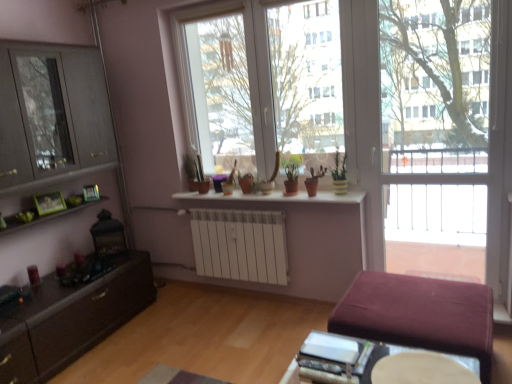
Question: Is transparent glass window at center facing away from brushed metal entertainment center at left?

Choices:
 (A) no
 (B) yes

Answer: (A)

Question: Does transparent glass window at center have a smaller size compared to brushed metal entertainment center at left?

Choices:
 (A) yes
 (B) no

Answer: (B)

Question: Could you tell me if transparent glass window at center is turned towards brushed metal entertainment center at left?

Choices:
 (A) yes
 (B) no

Answer: (B)

Question: Can you confirm if transparent glass window at center is shorter than brushed metal entertainment center at left?

Choices:
 (A) no
 (B) yes

Answer: (B)

Question: From the image's perspective, would you say transparent glass window at center is shown under brushed metal entertainment center at left?

Choices:
 (A) no
 (B) yes

Answer: (A)

Question: Is transparent glass window at center completely or partially outside of brushed metal entertainment center at left?

Choices:
 (A) yes
 (B) no

Answer: (A)

Question: Does matte brown pot at center, positioned as the 2th houseplant in right-to-left order, lie behind matte gray cabinet at left?

Choices:
 (A) no
 (B) yes

Answer: (B)

Question: Can you confirm if matte brown pot at center, positioned as the 2th houseplant in right-to-left order, is wider than matte gray cabinet at left?

Choices:
 (A) yes
 (B) no

Answer: (B)

Question: Does matte brown pot at center, positioned as the 2th houseplant in right-to-left order, have a larger size compared to matte gray cabinet at left?

Choices:
 (A) yes
 (B) no

Answer: (B)

Question: From the image's perspective, is matte brown pot at center, positioned as the 2th houseplant in right-to-left order, over matte gray cabinet at left?

Choices:
 (A) no
 (B) yes

Answer: (A)

Question: Is matte brown pot at center, arranged as the third houseplant when viewed from the left, next to matte gray cabinet at left and touching it?

Choices:
 (A) yes
 (B) no

Answer: (B)

Question: Can you confirm if matte brown pot at center, positioned as the 2th houseplant in right-to-left order, is positioned to the left of matte gray cabinet at left?

Choices:
 (A) no
 (B) yes

Answer: (A)

Question: Are matte brown pot at center, the 1th houseplant positioned from the left, and green matte plant at center, which is the first houseplant from right to left, far apart?

Choices:
 (A) yes
 (B) no

Answer: (A)